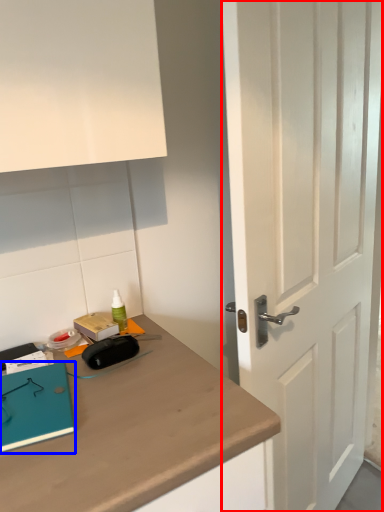
Question: Among these objects, which one is farthest to the camera, door (highlighted by a red box) or notebook (highlighted by a blue box)?

Choices:
 (A) door
 (B) notebook

Answer: (B)